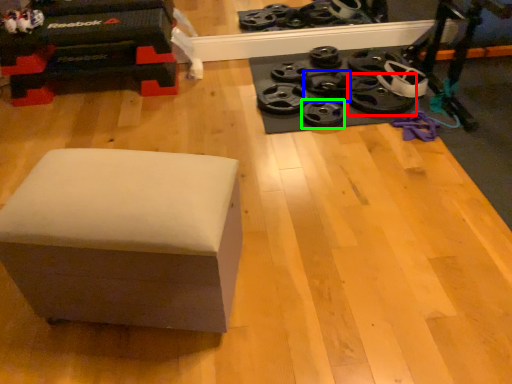
Question: Which object is the farthest from wheel (highlighted by a red box)? Choose among these: wheel (highlighted by a blue box) or wheel (highlighted by a green box).

Choices:
 (A) wheel
 (B) wheel

Answer: (B)